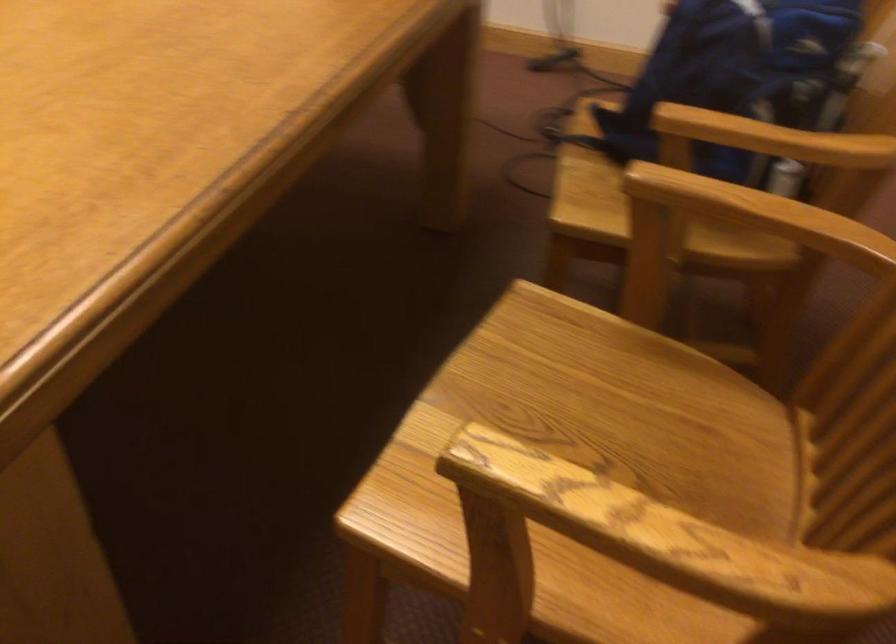
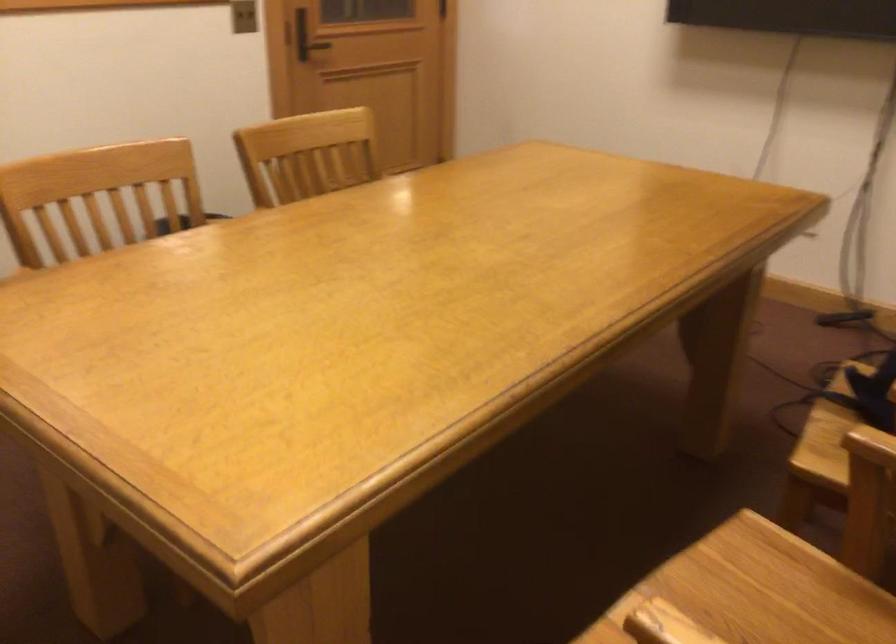
Locate, in the second image, the point that corresponds to (x=578, y=165) in the first image.

(823, 419)